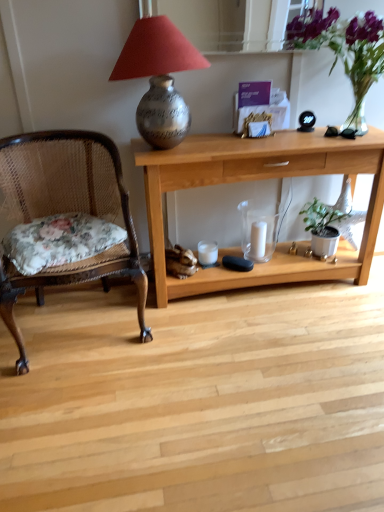
This screenshot has height=512, width=384. What are the coordinates of `vacant area that is in front of light wood desk at center` in the screenshot? It's located at (253, 371).